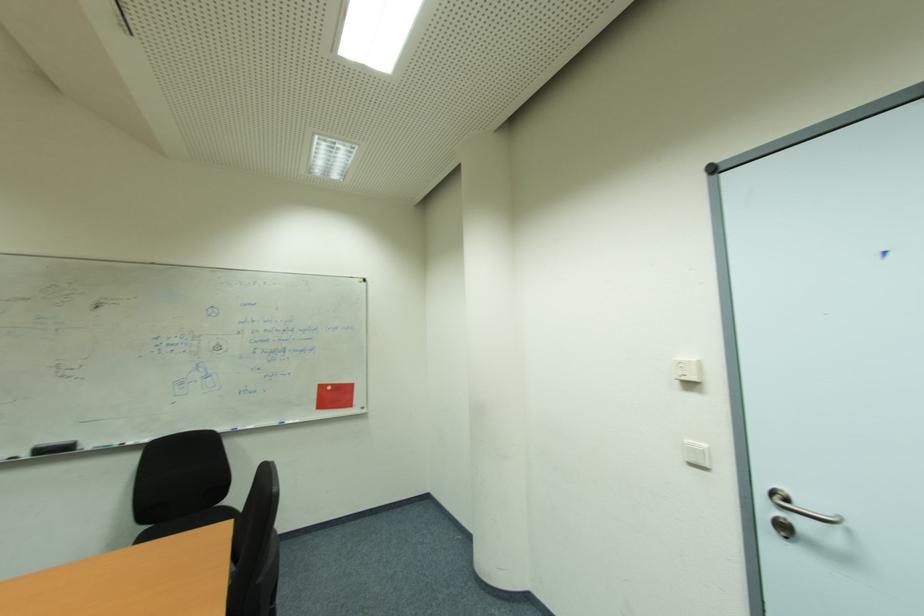
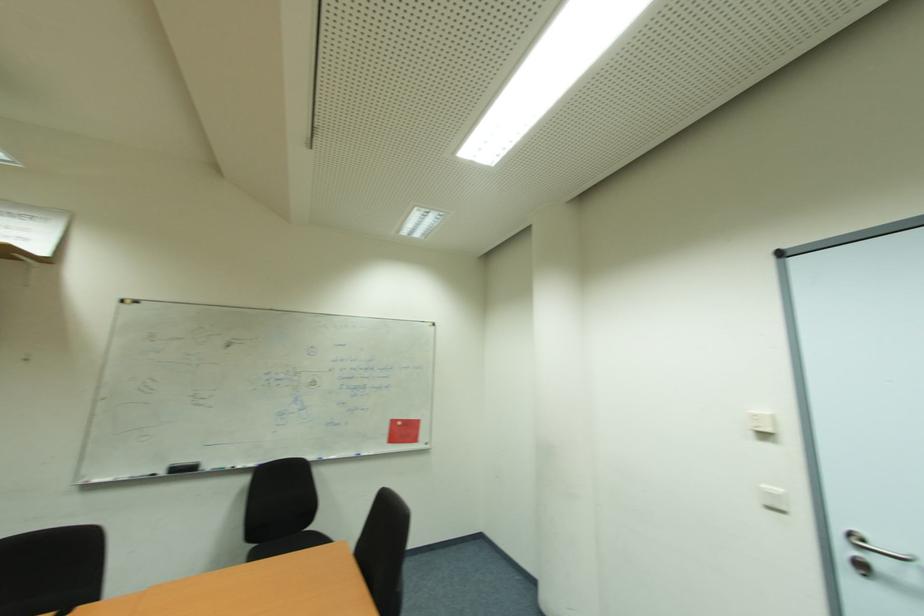
Find the pixel in the second image that matches the point at 324,387 in the first image.

(397, 423)